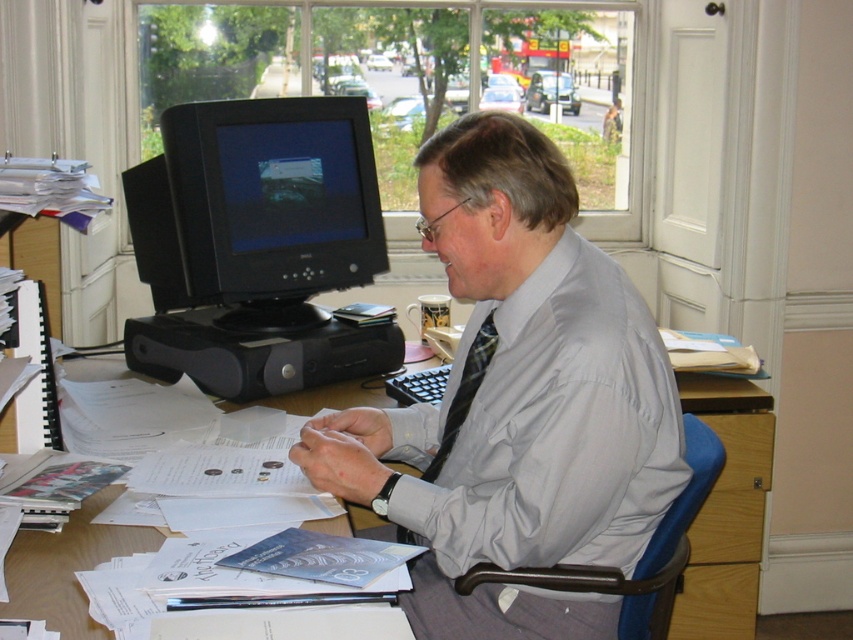
Which of these two, gray silk shirt at center or blue fabric swivel chair at right, stands shorter?

blue fabric swivel chair at right is shorter.

What are the coordinates of `gray silk shirt at center` in the screenshot? It's located at (x=515, y=401).

The image size is (853, 640). I want to click on gray silk shirt at center, so click(515, 401).

Between wooden desk at center and plaid fabric tie at center, which one appears on the right side from the viewer's perspective?

From the viewer's perspective, wooden desk at center appears more on the right side.

Describe the element at coordinates (726, 509) in the screenshot. I see `wooden desk at center` at that location.

The height and width of the screenshot is (640, 853). I want to click on wooden desk at center, so click(x=726, y=509).

Find the location of a particular element. Image resolution: width=853 pixels, height=640 pixels. wooden desk at center is located at coordinates (726, 509).

Who is positioned more to the left, gray silk shirt at center or plaid fabric tie at center?

plaid fabric tie at center

Does gray silk shirt at center have a greater width compared to plaid fabric tie at center?

Correct, the width of gray silk shirt at center exceeds that of plaid fabric tie at center.

Is point (569, 637) positioned behind point (474, 360)?

No, it is not.

This screenshot has width=853, height=640. In order to click on gray silk shirt at center in this screenshot , I will do `click(515, 401)`.